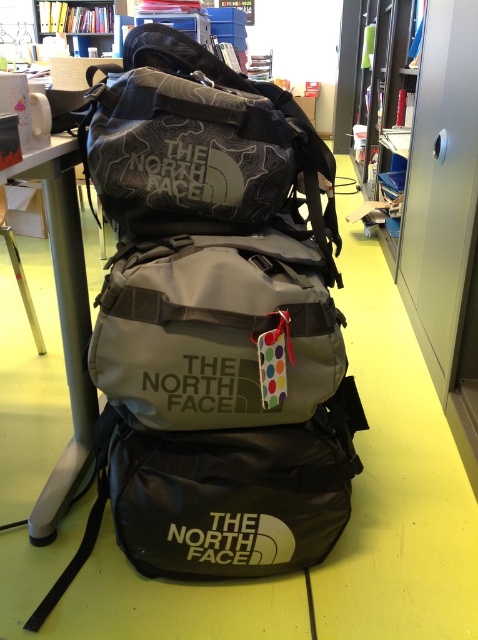
You are a GUI agent. You are given a task and a screenshot of the screen. Output one action in this format:
    pyautogui.click(x=<x>, y=<y>)
    Task: Click on the metallic silver table at left
    The width and height of the screenshot is (478, 640).
    Given the screenshot: What is the action you would take?
    pyautogui.click(x=65, y=324)

Does metallic silver table at left have a greater width compared to wooden bookshelf at upper left?

In fact, metallic silver table at left might be narrower than wooden bookshelf at upper left.

Between point (55, 148) and point (54, 12), which one is positioned in front?

Point (55, 148) is in front.

The image size is (478, 640). What are the coordinates of `metallic silver table at left` in the screenshot? It's located at (65, 324).